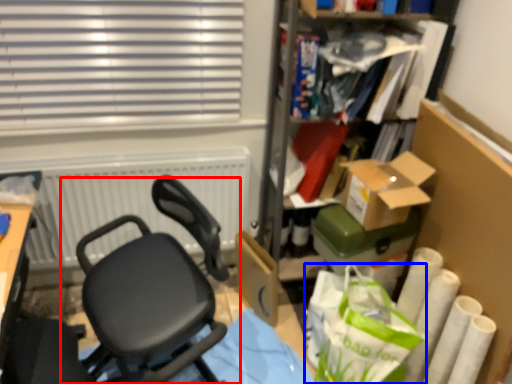
Question: Which object is closer to the camera taking this photo, chair (highlighted by a red box) or shopping bag (highlighted by a blue box)?

Choices:
 (A) chair
 (B) shopping bag

Answer: (A)